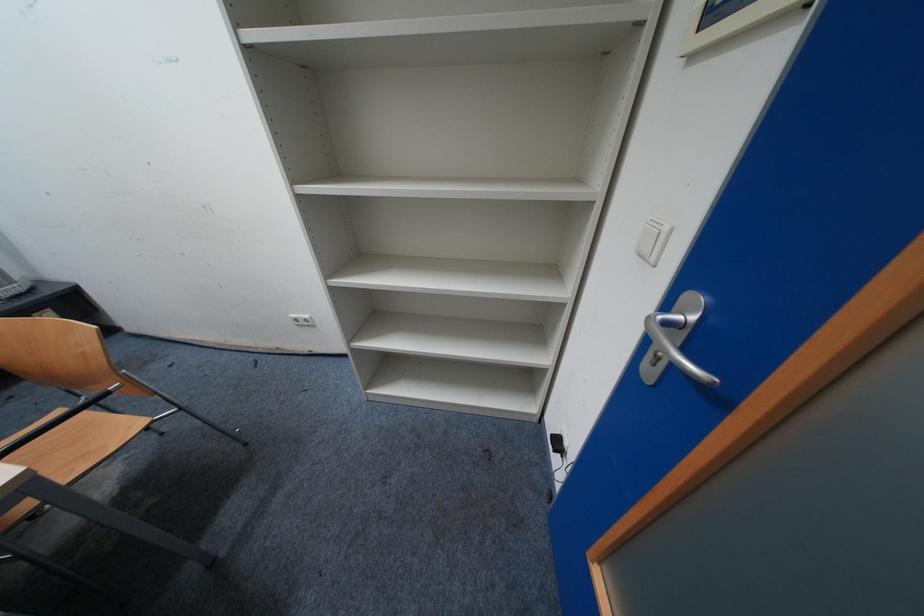
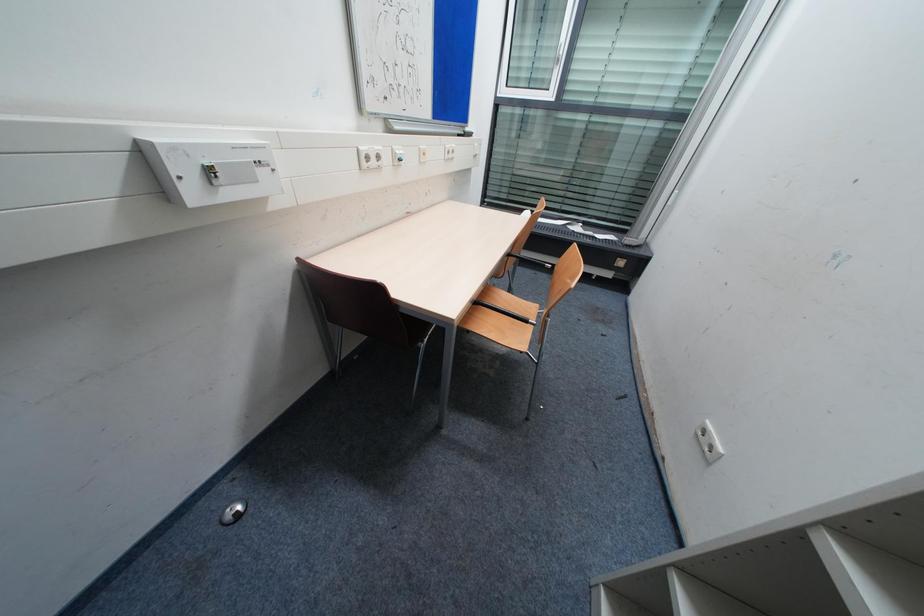
How did the camera likely rotate?

The rotation direction of the camera is left-down.